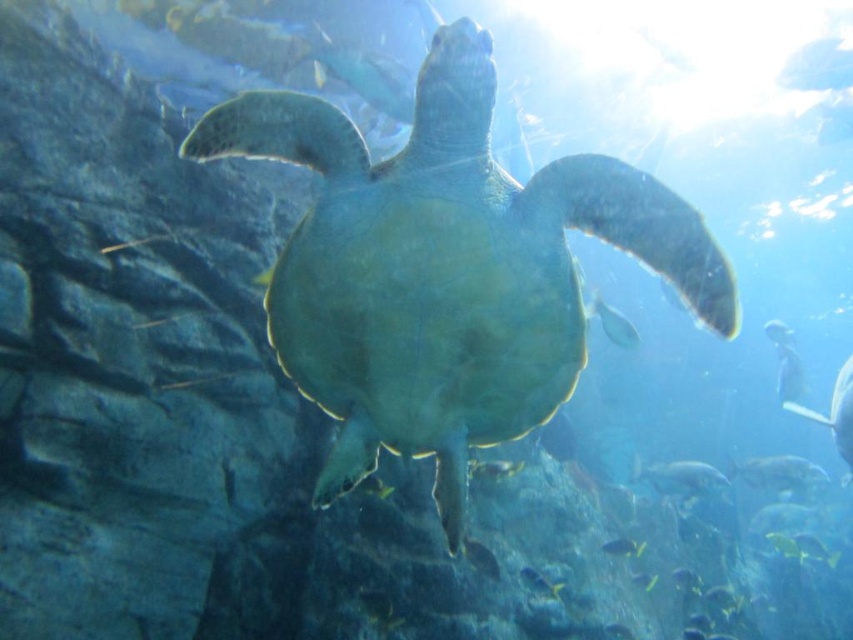
Question: Which point is farther to the camera?

Choices:
 (A) (705, 468)
 (B) (608, 308)

Answer: (A)

Question: Does translucent white fish at lower right appear on the right side of translucent blue fish at center?

Choices:
 (A) no
 (B) yes

Answer: (B)

Question: Considering the real-world distances, which object is farthest from the translucent greenish-blue fish at lower right?

Choices:
 (A) shiny silver fish at center
 (B) translucent blue fish at center
 (C) translucent blue fish at upper right

Answer: (A)

Question: Does green matte turtle at center have a lesser width compared to translucent white fish at lower right?

Choices:
 (A) yes
 (B) no

Answer: (B)

Question: Which of the following is the closest to the observer?

Choices:
 (A) (370, 276)
 (B) (805, 484)

Answer: (A)

Question: Is translucent white fish at lower right bigger than shiny silver fish at center?

Choices:
 (A) no
 (B) yes

Answer: (B)